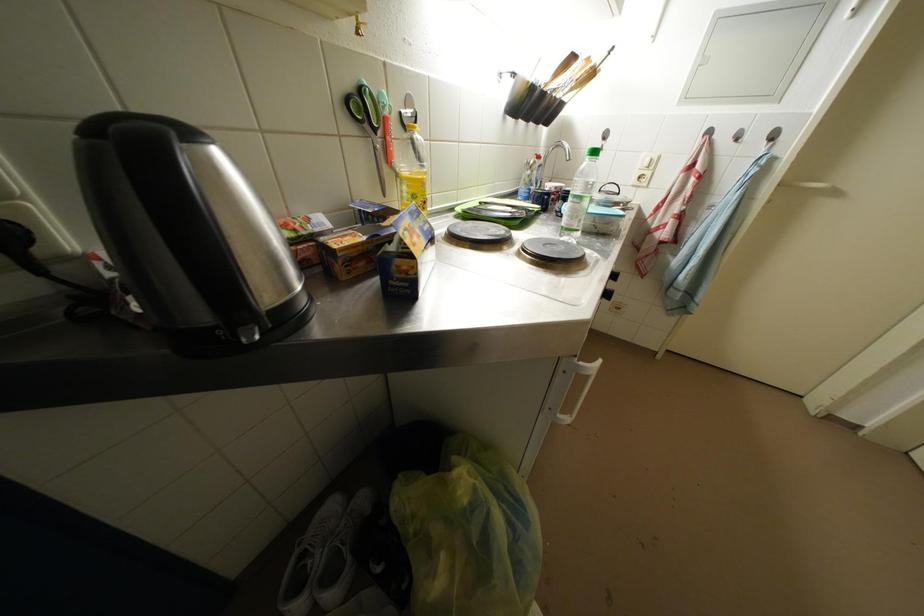
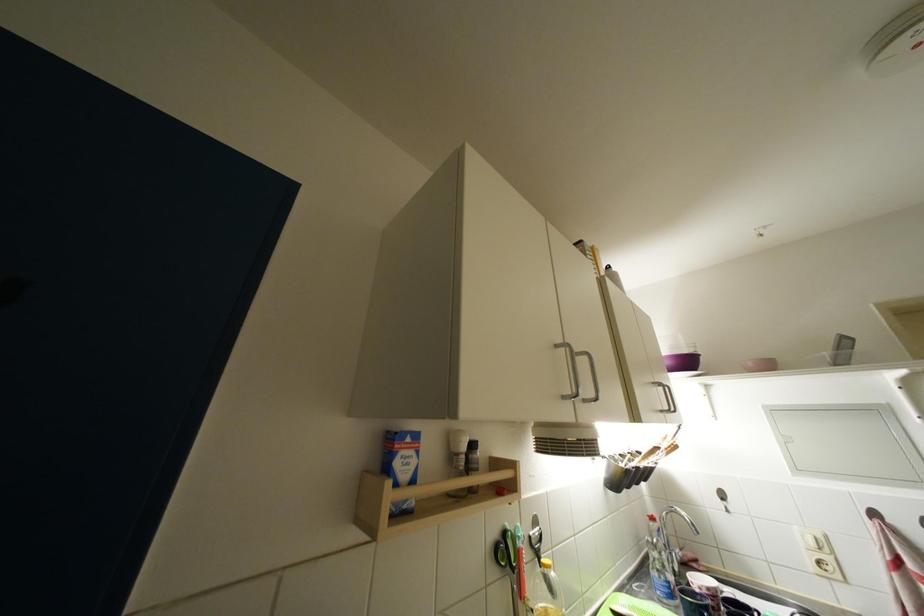
Where in the second image is the point corresponding to pixel 382 152 from the first image?

(518, 594)